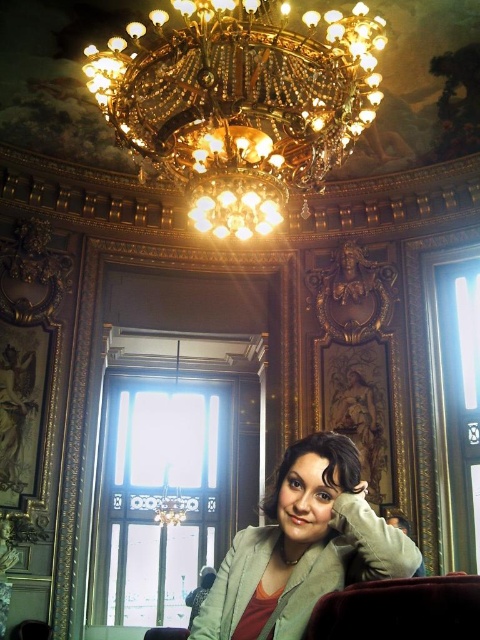
You are standing in the opulent room described. You see a point marked at coordinates (302, 547). What object in the room corresponds to this point?

The point at coordinates (302, 547) corresponds to the green matte jacket at lower right.

You are an interior designer planning to install a new light fixture in this room. The existing gold crystal chandelier at upper center is located at coordinates point 0.163, 0.502. If you want to place a new lamp exactly 0.1 units to the right of the chandelier, what would be the new coordinates?

The new coordinates would be calculated by adding 0.1 to the x coordinate of the gold crystal chandelier at upper center. The original coordinates are (240, 104). Adding 0.1 to the x value gives 0.263, so the new coordinates are (240, 168).